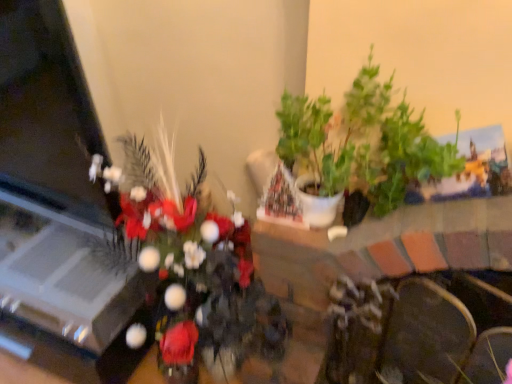
Question: Is velvet dark brown armchair at lower right oriented away from green leafy plant at center, positioned as the second houseplant in right-to-left order?

Choices:
 (A) no
 (B) yes

Answer: (A)

Question: Is velvet dark brown armchair at lower right behind green leafy plant at center, positioned as the second houseplant in right-to-left order?

Choices:
 (A) no
 (B) yes

Answer: (B)

Question: Is velvet dark brown armchair at lower right to the right of green leafy plant at center, positioned as the second houseplant in right-to-left order, from the viewer's perspective?

Choices:
 (A) no
 (B) yes

Answer: (B)

Question: Is velvet dark brown armchair at lower right smaller than green leafy plant at center, the first houseplant when ordered from left to right?

Choices:
 (A) yes
 (B) no

Answer: (A)

Question: Does velvet dark brown armchair at lower right turn towards green leafy plant at center, the first houseplant when ordered from left to right?

Choices:
 (A) yes
 (B) no

Answer: (B)

Question: From the image's perspective, is velvet dark brown armchair at lower right under green leafy plant at center, the first houseplant when ordered from left to right?

Choices:
 (A) yes
 (B) no

Answer: (A)

Question: Is green leafy plant at center, the first houseplant when ordered from left to right, next to green matte plant at upper right, the 1th houseplant from the right?

Choices:
 (A) no
 (B) yes

Answer: (A)

Question: From a real-world perspective, is green leafy plant at center, positioned as the second houseplant in right-to-left order, positioned over green matte plant at upper right, marked as the 2th houseplant in a left-to-right arrangement, based on gravity?

Choices:
 (A) yes
 (B) no

Answer: (B)

Question: Is green matte plant at upper right, the 1th houseplant from the right, located within green leafy plant at center, positioned as the second houseplant in right-to-left order?

Choices:
 (A) yes
 (B) no

Answer: (B)

Question: Considering the relative positions of green leafy plant at center, positioned as the second houseplant in right-to-left order, and green matte plant at upper right, marked as the 2th houseplant in a left-to-right arrangement, in the image provided, is green leafy plant at center, positioned as the second houseplant in right-to-left order, to the right of green matte plant at upper right, marked as the 2th houseplant in a left-to-right arrangement, from the viewer's perspective?

Choices:
 (A) no
 (B) yes

Answer: (A)

Question: Would you consider green leafy plant at center, positioned as the second houseplant in right-to-left order, to be distant from green matte plant at upper right, marked as the 2th houseplant in a left-to-right arrangement?

Choices:
 (A) no
 (B) yes

Answer: (A)

Question: Does green leafy plant at center, the first houseplant when ordered from left to right, have a greater height compared to green matte plant at upper right, the 1th houseplant from the right?

Choices:
 (A) no
 (B) yes

Answer: (B)

Question: Does velvet dark brown armchair at lower right turn towards green matte plant at upper right, marked as the 2th houseplant in a left-to-right arrangement?

Choices:
 (A) no
 (B) yes

Answer: (A)